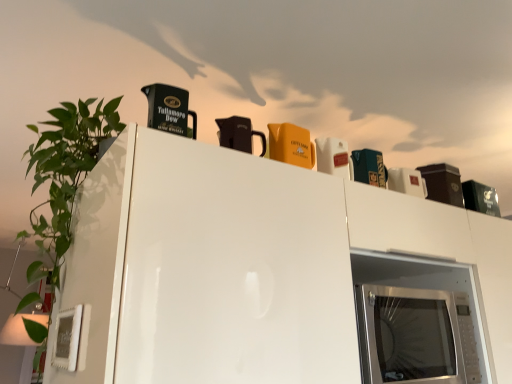
Measure the distance between point (453, 299) and camera.

Point (453, 299) is 1.46 meters from camera.

Identify the location of stainless steel microwave at right. (415, 336).

This screenshot has height=384, width=512. What do you see at coordinates (415, 336) in the screenshot? I see `stainless steel microwave at right` at bounding box center [415, 336].

The height and width of the screenshot is (384, 512). I want to click on stainless steel microwave at right, so click(x=415, y=336).